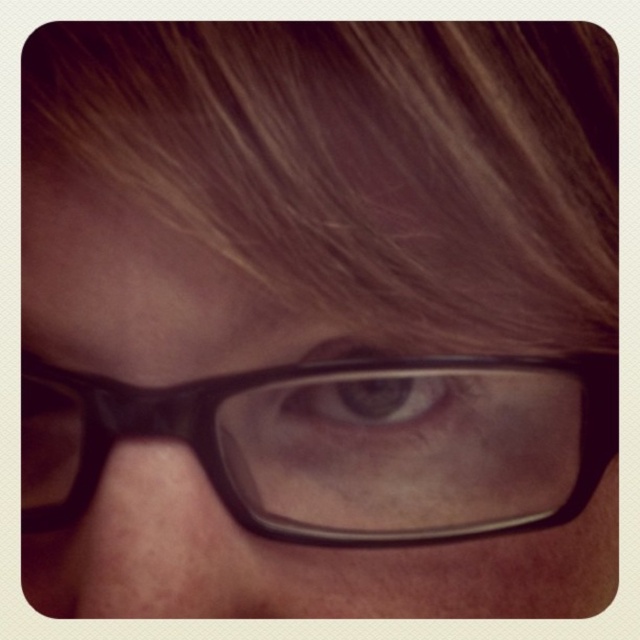
Question: Is black matte glasses at center thinner than black plastic glasses at center?

Choices:
 (A) yes
 (B) no

Answer: (B)

Question: Can you confirm if black matte glasses at center is positioned above matte black glasses at lower center?

Choices:
 (A) no
 (B) yes

Answer: (B)

Question: Which of the following is the farthest from the observer?

Choices:
 (A) brown smooth hair at upper center
 (B) matte black glasses at lower center

Answer: (B)

Question: Which of the following is the farthest from the observer?

Choices:
 (A) matte black eye at center
 (B) brown smooth hair at upper center
 (C) matte black glasses at lower center
 (D) black plastic glasses at center

Answer: (D)

Question: From the image, what is the correct spatial relationship of black matte glasses at center in relation to matte black eye at center?

Choices:
 (A) below
 (B) above

Answer: (A)

Question: Which point appears farthest from the camera in this image?

Choices:
 (A) (81, 408)
 (B) (212, 102)
 (C) (422, 384)

Answer: (C)